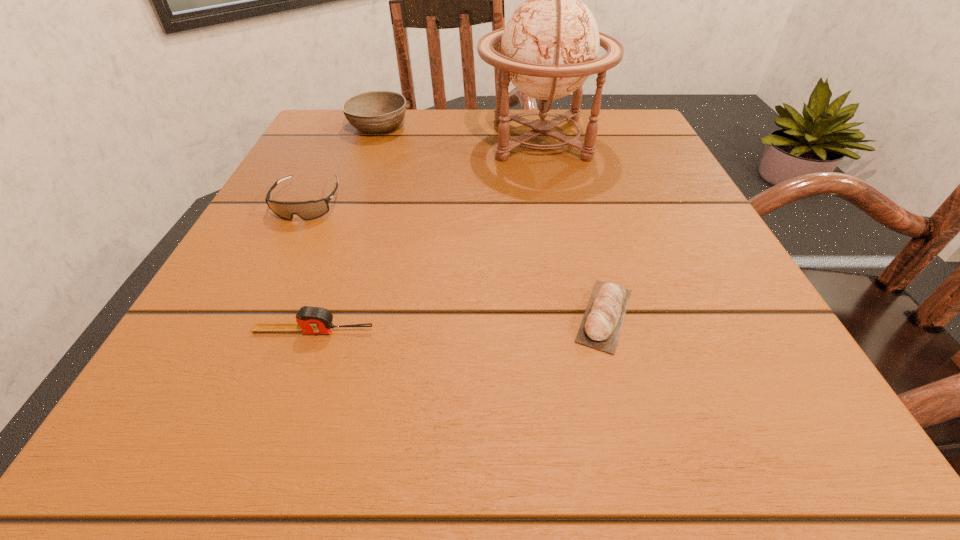
The height and width of the screenshot is (540, 960). I want to click on vacant space situated 0.150m on the right of the tape measure, so click(491, 331).

The height and width of the screenshot is (540, 960). I want to click on vacant space located on the right of the shortest object, so click(678, 315).

What are the coordinates of `globe present at the far edge` in the screenshot? It's located at (549, 47).

Identify the location of bowl that is at the far edge. The width and height of the screenshot is (960, 540). (375, 112).

Find the location of a particular element. bowl at the left edge is located at coordinates click(375, 112).

You are a GUI agent. You are given a task and a screenshot of the screen. Output one action in this format:
    pyautogui.click(x=<x>, y=<y>)
    Task: Click on the goggles present at the left edge
    The width and height of the screenshot is (960, 540).
    Given the screenshot: What is the action you would take?
    pyautogui.click(x=307, y=210)

Locate an element on the screen. tape measure positioned at the left edge is located at coordinates (311, 320).

I want to click on object that is at the right edge, so click(549, 47).

You are a GUI agent. You are given a task and a screenshot of the screen. Output one action in this format:
    pyautogui.click(x=<x>, y=<y>)
    Task: Click on the object that is at the far left corner
    The image size is (960, 540).
    Given the screenshot: What is the action you would take?
    pyautogui.click(x=375, y=112)

Identify the location of object at the far right corner. (549, 47).